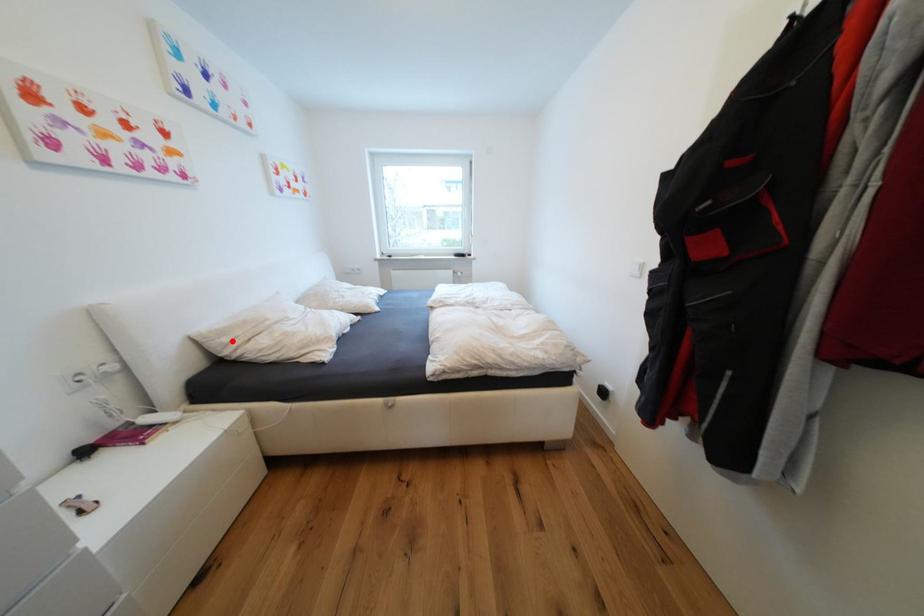
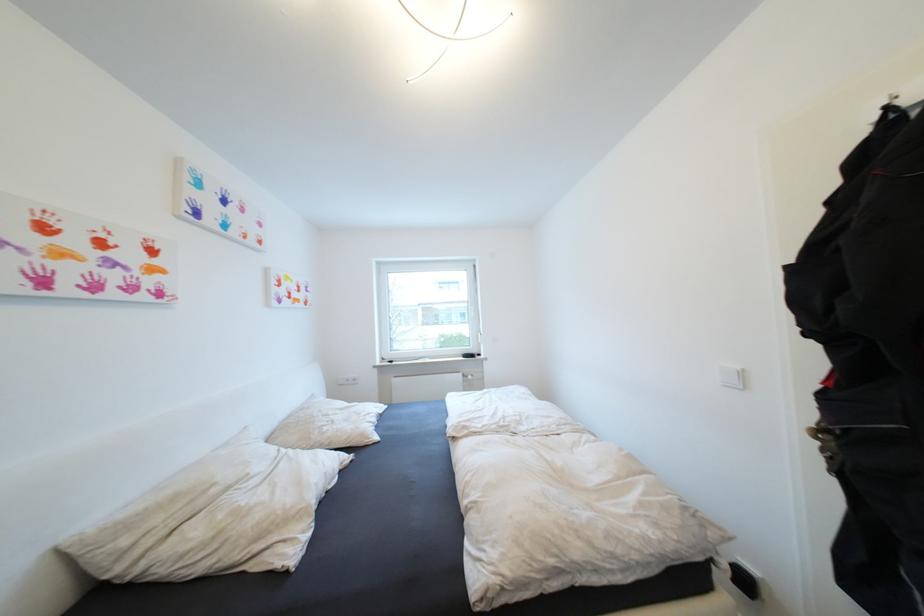
The point at the highlighted location is marked in the first image. Where is the corresponding point in the second image?

(131, 543)